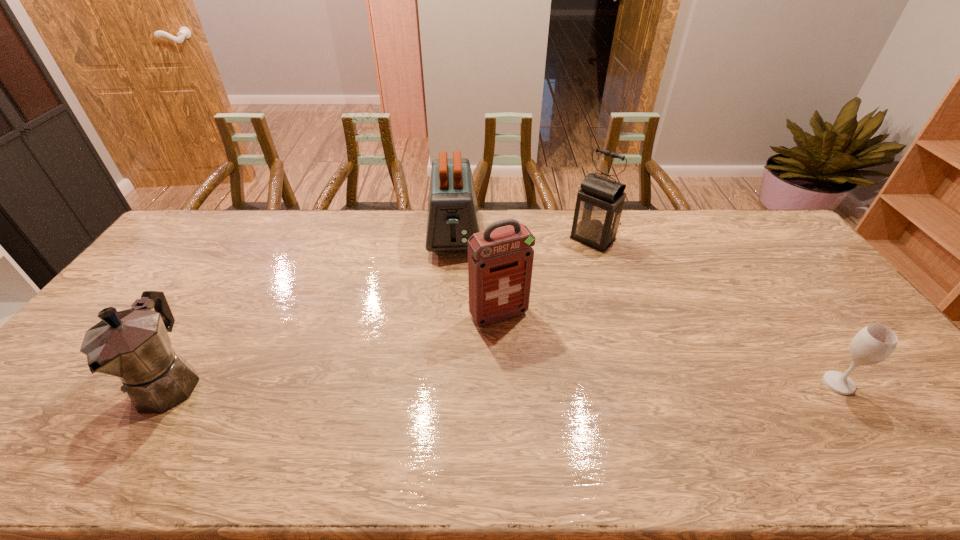
I want to click on coffeepot, so coord(133,345).

I want to click on wineglass, so click(874, 343).

The height and width of the screenshot is (540, 960). I want to click on the shortest object, so click(874, 343).

Identify the location of the first-aid kit. Image resolution: width=960 pixels, height=540 pixels. (500, 260).

Locate an element on the screen. lantern is located at coordinates (599, 205).

I want to click on toaster, so click(452, 218).

Locate an element on the screen. Image resolution: width=960 pixels, height=540 pixels. vacant space located 0.080m on the right of the wineglass is located at coordinates (884, 383).

At what (x,y) coordinates should I click in order to perform the action: click on free space located 0.220m on the front-facing side of the third farthest object. Please return your answer as a coordinate pair (x, y). Image resolution: width=960 pixels, height=540 pixels. Looking at the image, I should click on (546, 390).

The height and width of the screenshot is (540, 960). I want to click on blank area located 0.130m on the front-facing side of the third farthest object, so click(x=531, y=363).

Where is `free spot located on the front-facing side of the third farthest object`? The image size is (960, 540). free spot located on the front-facing side of the third farthest object is located at coordinates (540, 377).